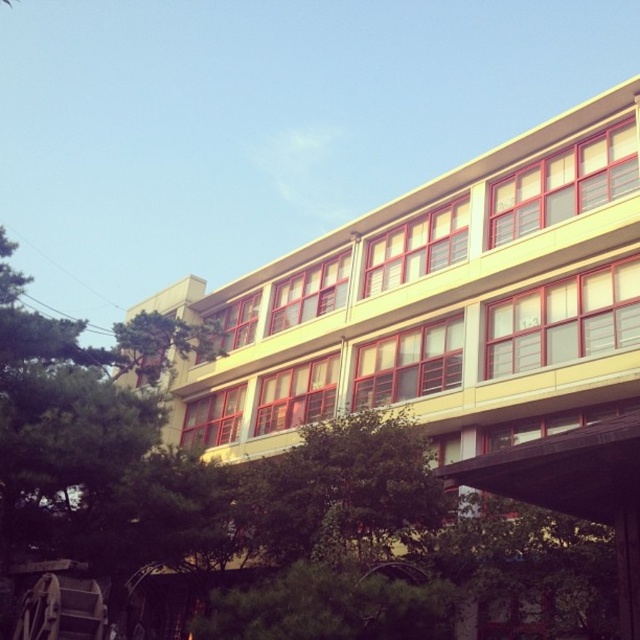
Consider the image. You are standing in front of the yellow matte building at center and the green leafy tree at center. Which object is closer to you?

The yellow matte building at center is closer to you because it is in front of the green leafy tree at center.

You are a city planner trying to install a new streetlight between the yellow matte building at center and the green leafy tree at center. The streetlight requires a minimum of 10 feet of space between the building and the tree to be installed. Based on the image, can the streetlight be placed there?

The yellow matte building at center and green leafy tree at center are 10.16 feet apart from each other, which meets the minimum requirement of 10 feet. Therefore, the streetlight can be installed between them.

You are a city planner assessing the visibility of the yellow matte building at center from the main road. Considering the presence of the green leafy tree at center, would the building be mostly visible or mostly obscured?

The yellow matte building at center has a larger size compared to green leafy tree at center, so the building would mostly be visible despite the tree.